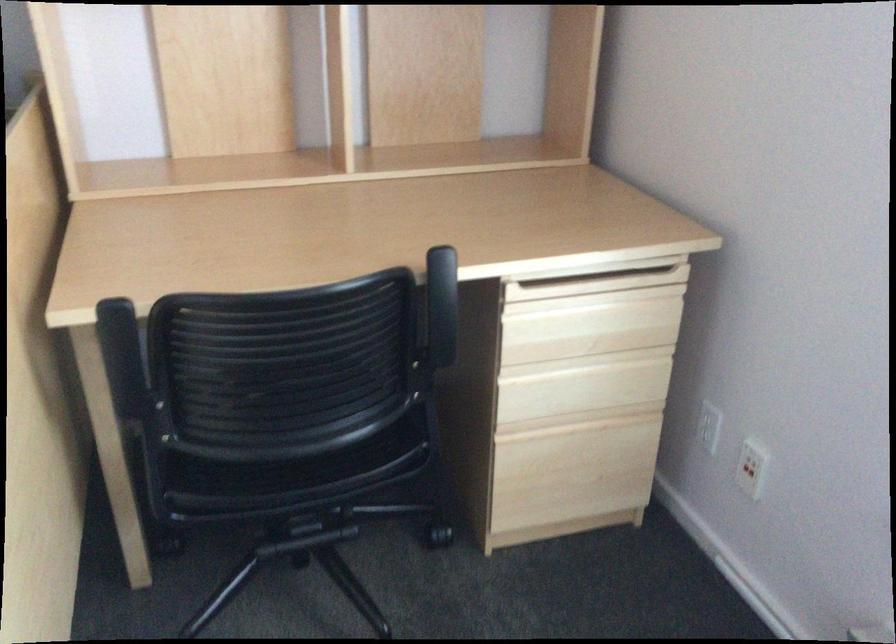
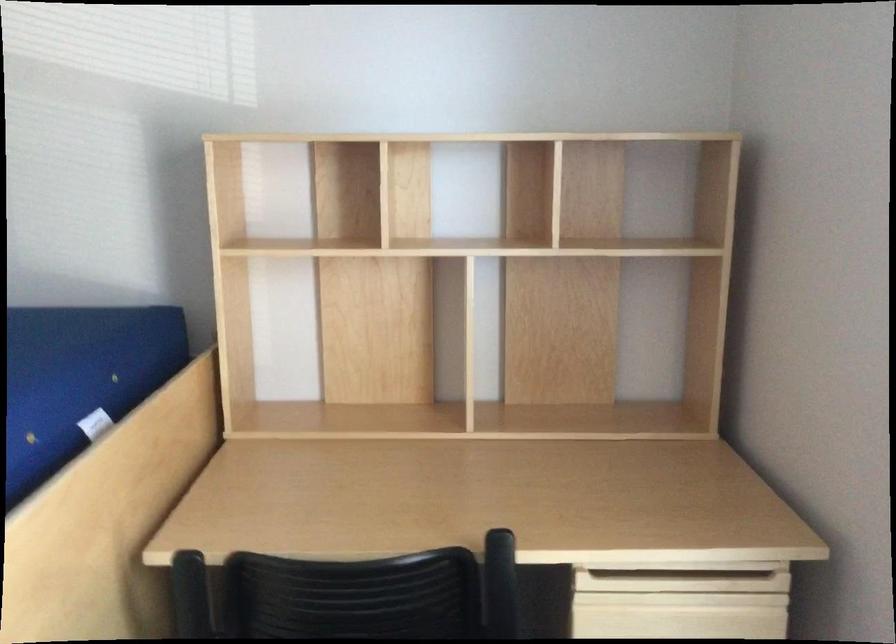
Question: In a continuous first-person perspective shot, in which direction is the camera moving?

Choices:
 (A) Left
 (B) Right
 (C) Forward
 (D) Backward

Answer: (B)